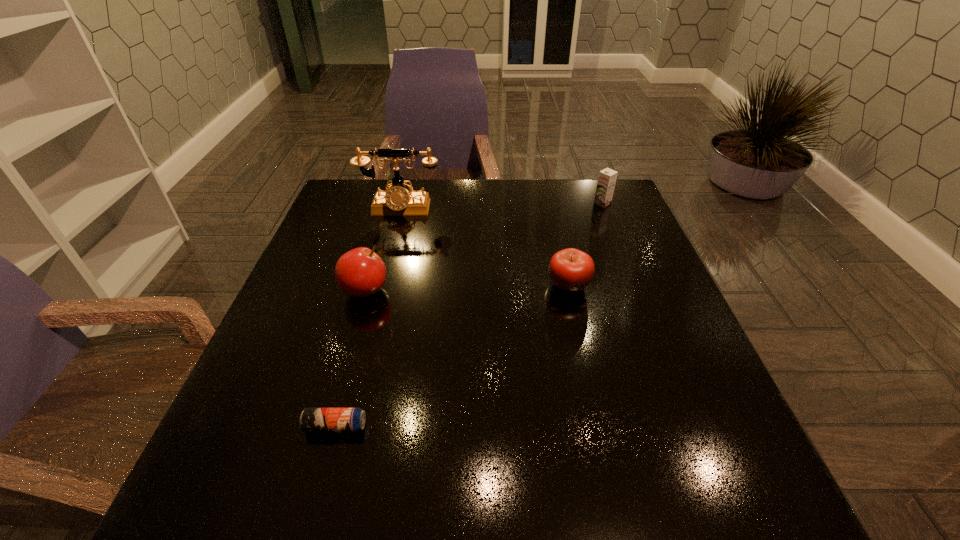
Where is `blank area located 0.220m on the back of the nearest object`? The width and height of the screenshot is (960, 540). blank area located 0.220m on the back of the nearest object is located at coordinates (363, 323).

I want to click on telephone at the far edge, so click(396, 201).

Identify the location of chocolate milk at the far edge. (607, 178).

The image size is (960, 540). Identify the location of telephone situated at the left edge. (396, 201).

This screenshot has width=960, height=540. Find the location of `apple located in the left edge section of the desktop`. apple located in the left edge section of the desktop is located at coordinates (360, 272).

Where is `beer can that is at the left edge`? The width and height of the screenshot is (960, 540). beer can that is at the left edge is located at coordinates (311, 419).

In order to click on object at the right edge in this screenshot , I will do `click(607, 178)`.

Where is `object situated at the far left corner`? This screenshot has height=540, width=960. object situated at the far left corner is located at coordinates (396, 201).

Where is `object at the far right corner`? The width and height of the screenshot is (960, 540). object at the far right corner is located at coordinates (607, 178).

You are a GUI agent. You are given a task and a screenshot of the screen. Output one action in this format:
    pyautogui.click(x=<x>, y=<y>)
    Task: Click on the vacant area at the far edge
    Image resolution: width=960 pixels, height=540 pixels.
    Given the screenshot: What is the action you would take?
    pos(444,181)